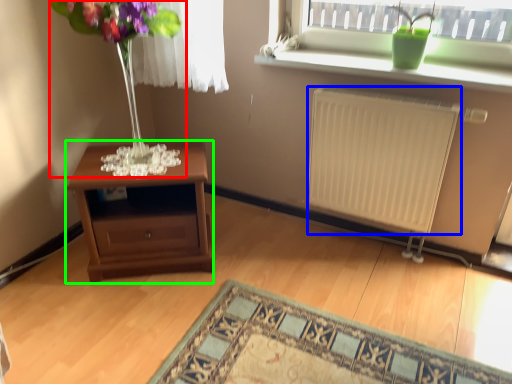
Question: Which object is the farthest from bouquet (highlighted by a red box)? Choose among these: radiator (highlighted by a blue box) or table (highlighted by a green box).

Choices:
 (A) radiator
 (B) table

Answer: (A)